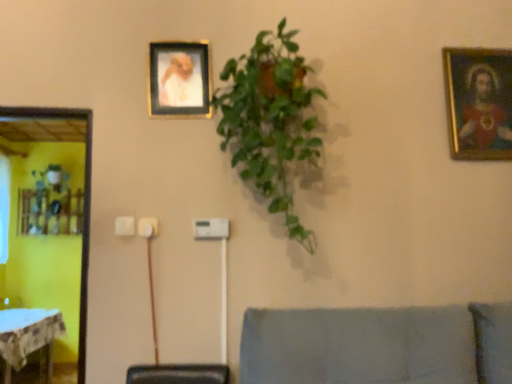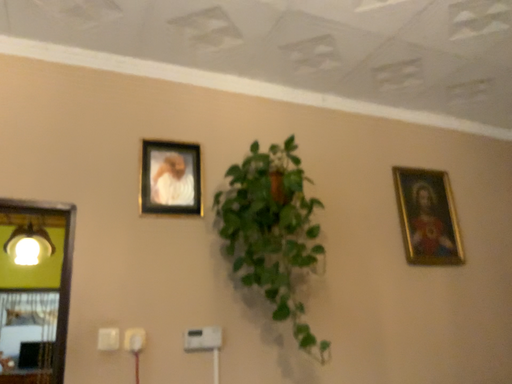
Question: How did the camera likely rotate when shooting the video?

Choices:
 (A) rotated right
 (B) rotated left

Answer: (A)